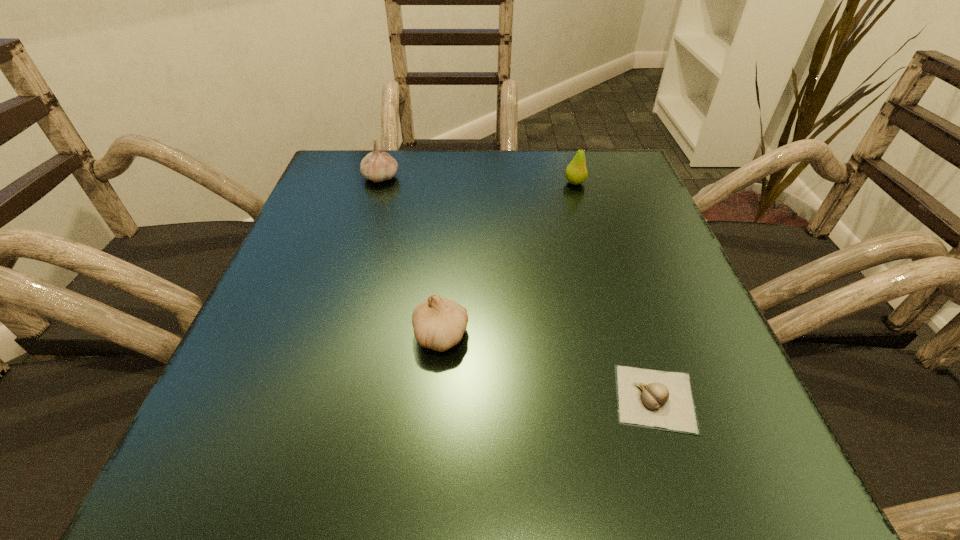
Where is `pear`? pear is located at coordinates (576, 172).

The width and height of the screenshot is (960, 540). I want to click on the leftmost garlic, so click(x=377, y=166).

Image resolution: width=960 pixels, height=540 pixels. Identify the location of the leftmost object. (377, 166).

The height and width of the screenshot is (540, 960). I want to click on the second object from left to right, so click(438, 323).

I want to click on the second nearest garlic, so click(x=438, y=323).

Image resolution: width=960 pixels, height=540 pixels. I want to click on the shortest object, so click(x=663, y=400).

The image size is (960, 540). I want to click on the nearest object, so click(663, 400).

Image resolution: width=960 pixels, height=540 pixels. I want to click on free space located 0.330m on the left of the pear, so [418, 183].

Identify the location of vacant space located 0.220m on the front of the farthest garlic. (358, 251).

Locate an element on the screen. The image size is (960, 540). free space located 0.070m on the left of the third farthest object is located at coordinates (368, 335).